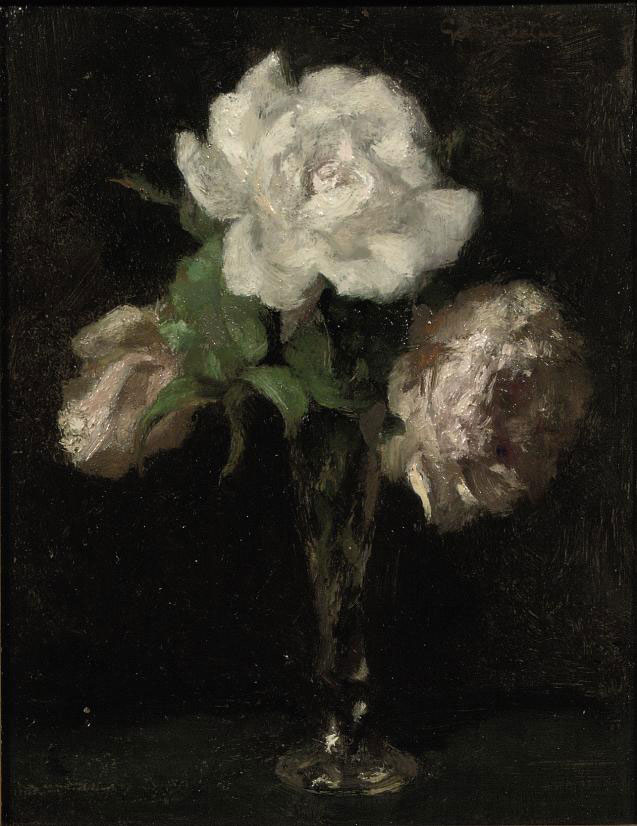
Locate an element on the screen. This screenshot has height=826, width=637. painting of flowers is located at coordinates (369, 335).